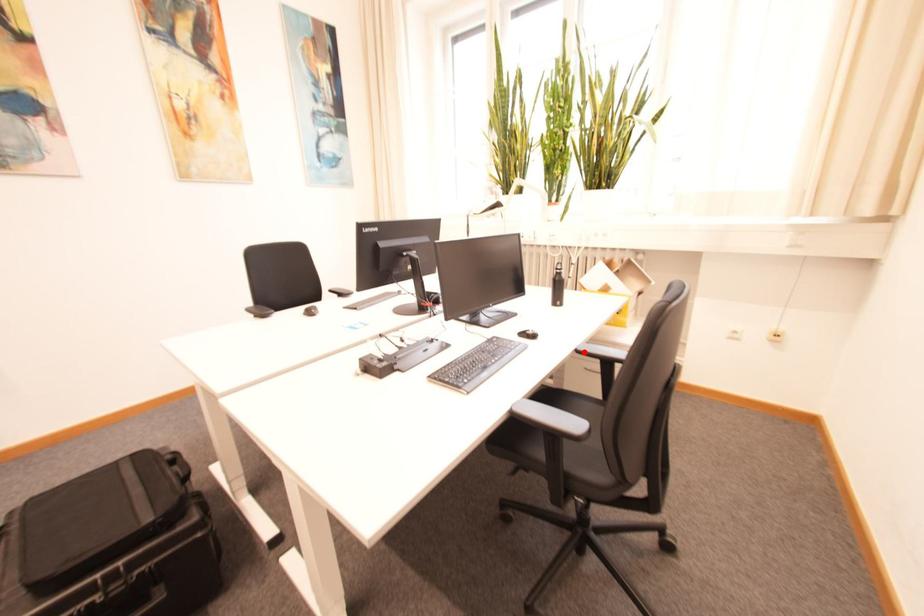
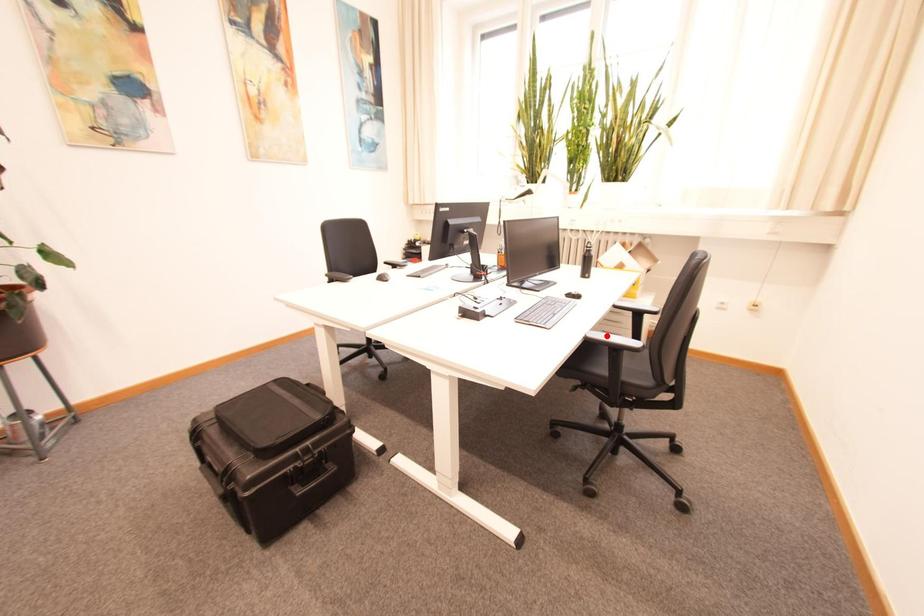
I am providing you with two images of the same scene from different viewpoints. A red point is marked on the first image and another point is marked on the second image. Do the highlighted points in image1 and image2 indicate the same real-world spot?

No